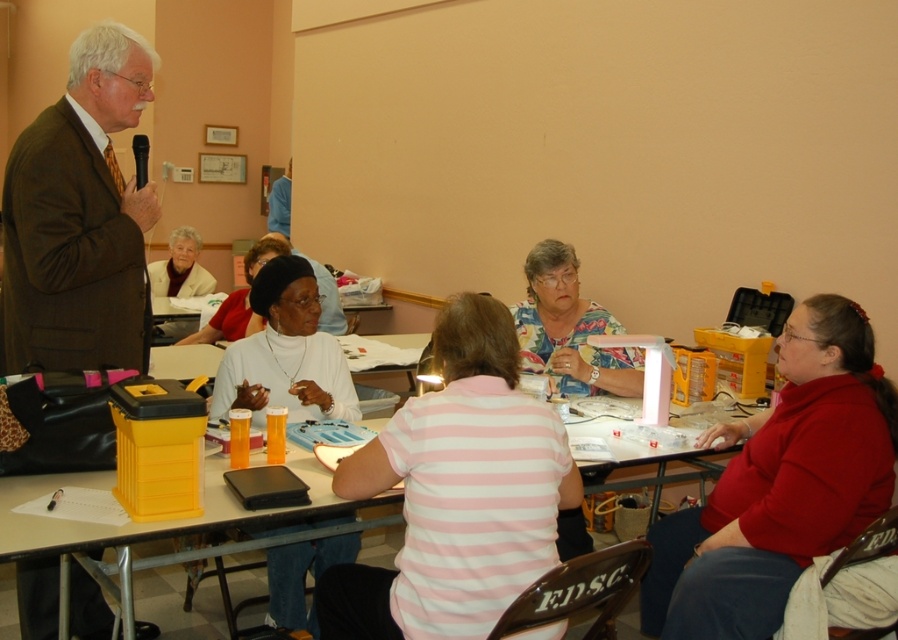
You are standing in the room and want to hand out a document to both the person wearing the pink striped shirt at center and the person wearing the white fabric shirt at center. Which one can you reach first without moving from your current position?

You can reach the pink striped shirt at center first because it is closer to you than the white fabric shirt at center.

You are a photographer standing at the camera position. You need to take a closeup photo of the red matte sweater at lower right. The camera has a minimum focusing distance of 1.5 meters. Can you take the photo without moving the camera or the sweater?

The distance between the red matte sweater at lower right and the camera is 2.09 meters, which is greater than the minimum focusing distance of 1.5 meters. Therefore, you can take the closeup photo without moving either the camera or the sweater.